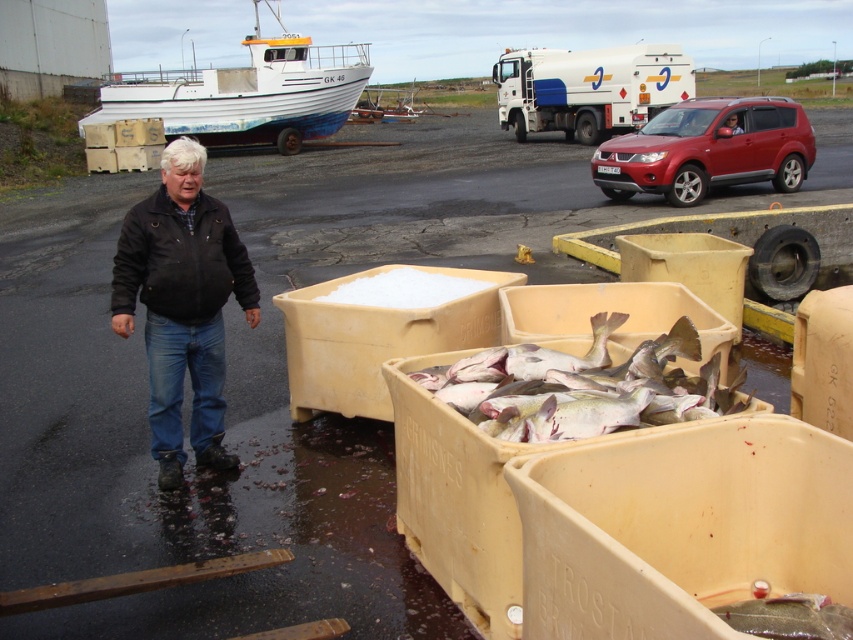
Question: Estimate the real-world distances between objects in this image. Which object is closer to the white painted wood boat at upper left?

Choices:
 (A) black leather jacket at left
 (B) pale pink flesh at center

Answer: (B)

Question: Which object appears farthest from the camera in this image?

Choices:
 (A) black leather jacket at left
 (B) white painted wood boat at upper left
 (C) pale pink flesh at center

Answer: (B)

Question: Which object appears farthest from the camera in this image?

Choices:
 (A) pale pink flesh at center
 (B) white painted wood boat at upper left
 (C) black leather jacket at left

Answer: (B)

Question: Can you confirm if pale pink flesh at center is positioned to the right of white painted wood boat at upper left?

Choices:
 (A) yes
 (B) no

Answer: (A)

Question: Can you confirm if black leather jacket at left is positioned above white painted wood boat at upper left?

Choices:
 (A) yes
 (B) no

Answer: (B)

Question: Can you confirm if pale pink flesh at center is positioned below white painted wood boat at upper left?

Choices:
 (A) yes
 (B) no

Answer: (A)